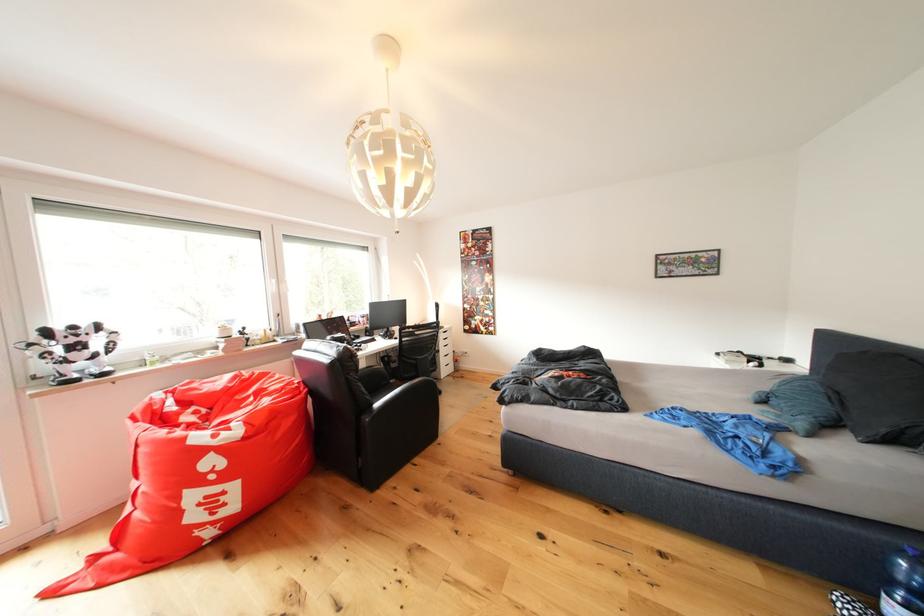
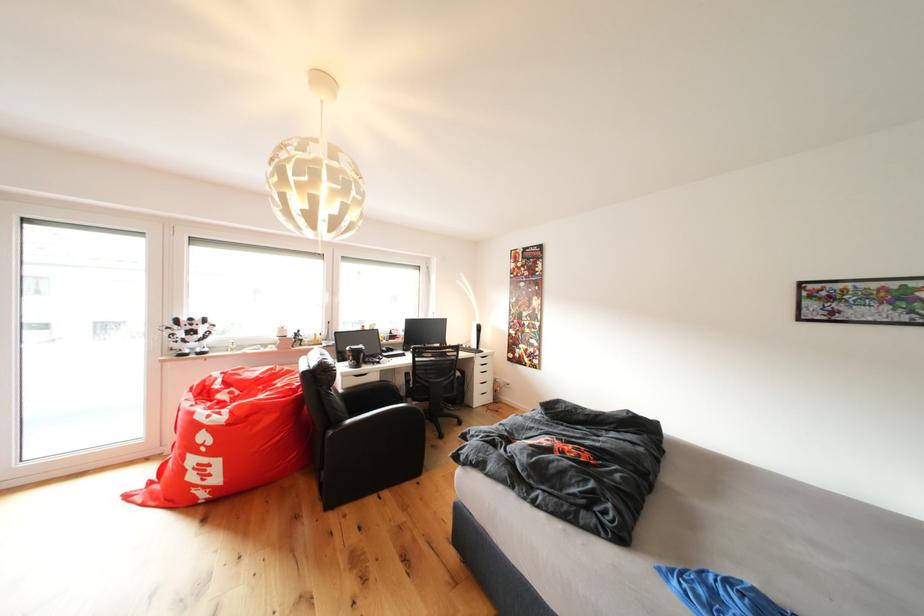
Where in the second image is the point corresponding to point 377,371 from the first image?

(390, 387)